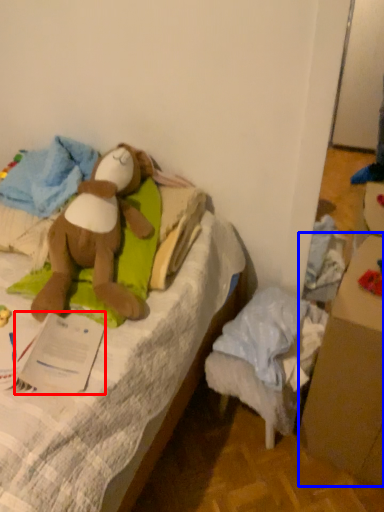
Question: Which point is closer to the camera, paper (highlighted by a red box) or cardboard box (highlighted by a blue box)?

Choices:
 (A) paper
 (B) cardboard box

Answer: (B)